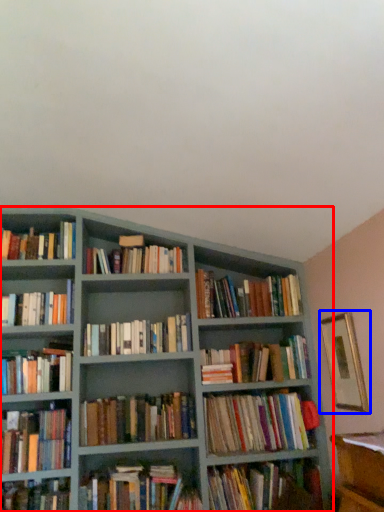
Question: Which point is further to the camera, bookcase (highlighted by a red box) or picture frame (highlighted by a blue box)?

Choices:
 (A) bookcase
 (B) picture frame

Answer: (A)